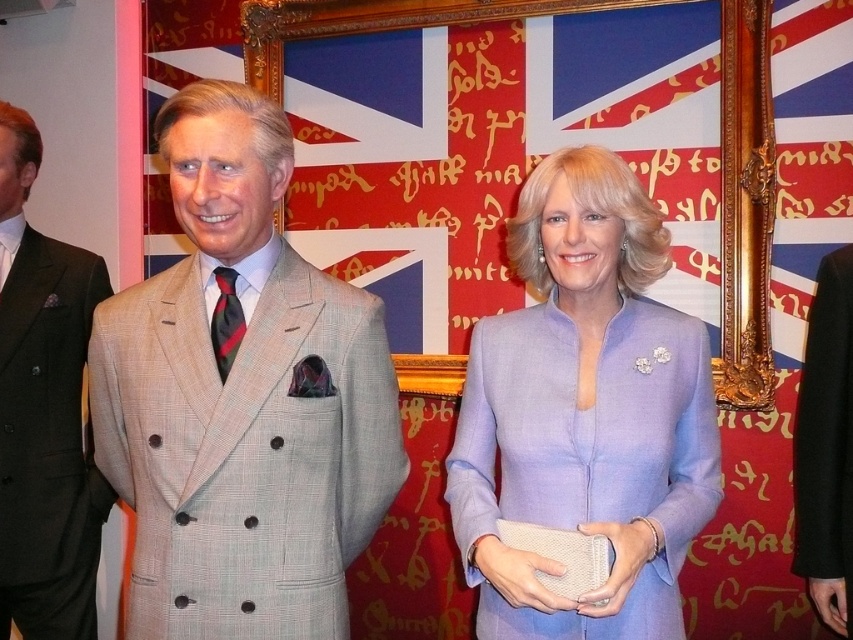
Can you confirm if light beige wool suit at left is shorter than black wool suit at right?

No.

You are a GUI agent. You are given a task and a screenshot of the screen. Output one action in this format:
    pyautogui.click(x=<x>, y=<y>)
    Task: Click on the light beige wool suit at left
    The width and height of the screenshot is (853, 640).
    Given the screenshot: What is the action you would take?
    pyautogui.click(x=44, y=412)

How distant is light beige wool suit at center from lavender woolen suit at center?

The distance of light beige wool suit at center from lavender woolen suit at center is 13.56 inches.

Who is more forward, (204, 252) or (511, 458)?

Point (204, 252) is in front.

The height and width of the screenshot is (640, 853). Find the location of `light beige wool suit at center`. light beige wool suit at center is located at coordinates (241, 397).

Does point (576, 198) lie behind point (816, 424)?

No, (576, 198) is in front of (816, 424).

Does lavender woolen suit at center have a lesser width compared to black wool suit at right?

No.

I want to click on lavender woolen suit at center, so click(585, 412).